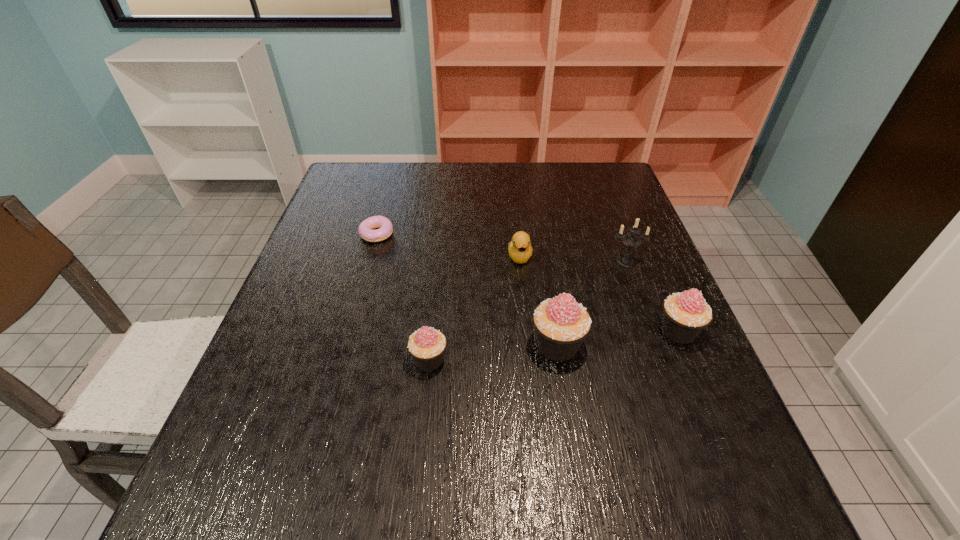
Identify the location of free spot between the tallest cupcake and the candle holder. The image size is (960, 540). (591, 303).

Locate an element on the screen. The height and width of the screenshot is (540, 960). free space between the second cupcake from right to left and the duckling is located at coordinates (539, 301).

At what (x,y) coordinates should I click in order to perform the action: click on unoccupied area between the rightmost cupcake and the tallest cupcake. Please return your answer as a coordinate pair (x, y). This screenshot has width=960, height=540. Looking at the image, I should click on (618, 338).

Point out which object is positioned as the fourth nearest to the tallest cupcake. Please provide its 2D coordinates. Your answer should be formatted as a tuple, i.e. [(x, y)], where the tuple contains the x and y coordinates of a point satisfying the conditions above.

[(631, 240)]

What are the coordinates of `object that is the fourth closest to the rightmost cupcake` in the screenshot? It's located at (427, 345).

This screenshot has height=540, width=960. Identify the location of cupcake that is the closest one to the fifth tallest object. (561, 324).

Select which cupcake appears as the second closest to the candle holder. Please provide its 2D coordinates. Your answer should be formatted as a tuple, i.e. [(x, y)], where the tuple contains the x and y coordinates of a point satisfying the conditions above.

[(561, 324)]

The image size is (960, 540). I want to click on vacant region that satisfies the following two spatial constraints: 1. on the face of the second cupcake from left to right; 2. on the right side of the duckling, so click(x=529, y=345).

At what (x,y) coordinates should I click in order to perform the action: click on vacant area that satisfies the following two spatial constraints: 1. on the face of the candle holder; 2. on the right side of the fifth tallest object. Please return your answer as a coordinate pair (x, y). The image size is (960, 540). Looking at the image, I should click on (520, 261).

I want to click on free space that satisfies the following two spatial constraints: 1. on the front side of the candle holder; 2. on the left side of the rightmost cupcake, so point(652,331).